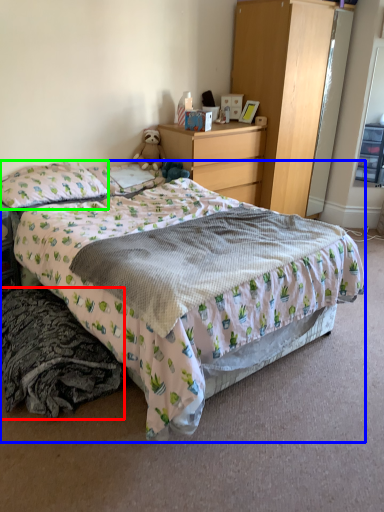
Question: Which object is the farthest from material (highlighted by a red box)? Choose among these: bed (highlighted by a blue box) or pillow (highlighted by a green box).

Choices:
 (A) bed
 (B) pillow

Answer: (B)